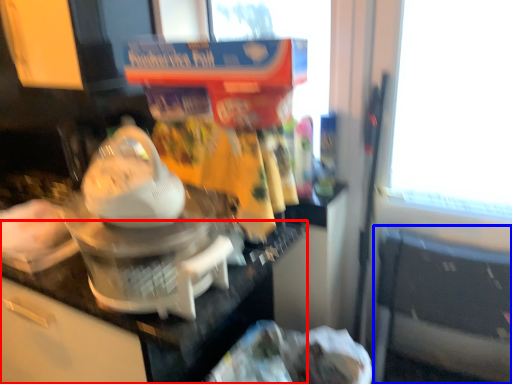
Question: Which object appears closest to the camera in this image, counter top (highlighted by a red box) or chair (highlighted by a blue box)?

Choices:
 (A) counter top
 (B) chair

Answer: (A)